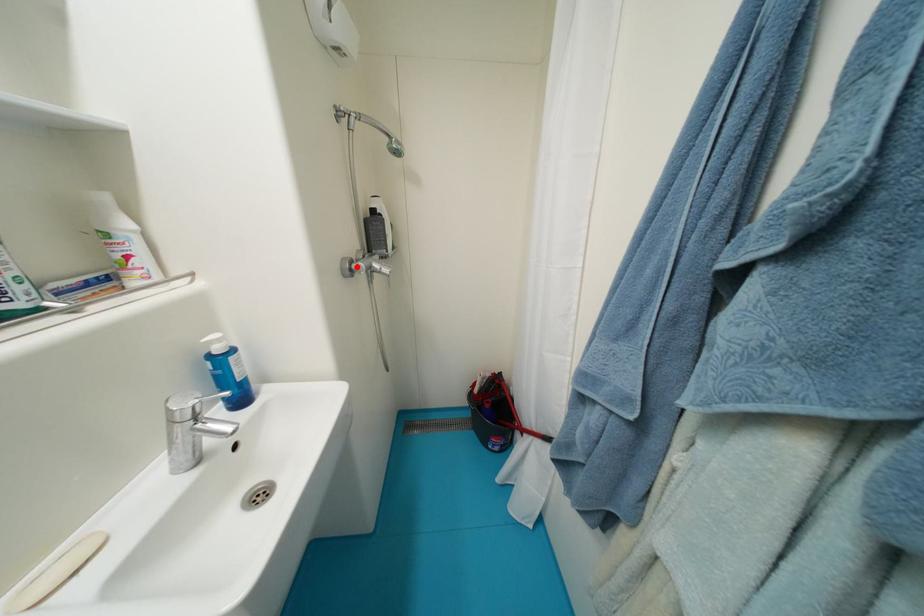
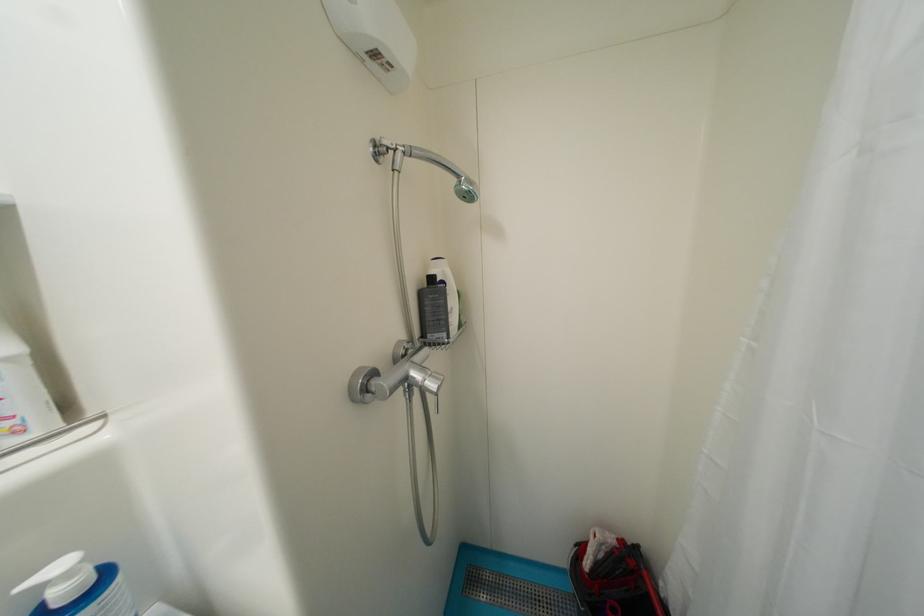
The point at the highlighted location is marked in the first image. Where is the corresponding point in the second image?

(374, 383)